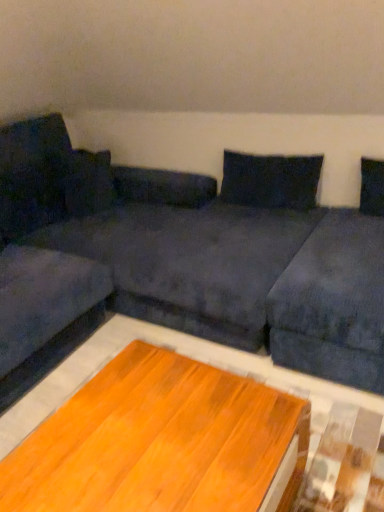
Question: Is velvet dark blue couch at left to the right of dark blue fabric pillow at upper center from the viewer's perspective?

Choices:
 (A) no
 (B) yes

Answer: (A)

Question: Are velvet dark blue couch at left and dark blue fabric pillow at upper center making contact?

Choices:
 (A) no
 (B) yes

Answer: (A)

Question: From a real-world perspective, is velvet dark blue couch at left on dark blue fabric pillow at upper center?

Choices:
 (A) yes
 (B) no

Answer: (B)

Question: Does velvet dark blue couch at left have a greater height compared to dark blue fabric pillow at upper center?

Choices:
 (A) no
 (B) yes

Answer: (B)

Question: Can you confirm if velvet dark blue couch at left is wider than dark blue fabric pillow at upper center?

Choices:
 (A) no
 (B) yes

Answer: (B)

Question: Considering the positions of point (178, 280) and point (172, 382), is point (178, 280) closer or farther from the camera than point (172, 382)?

Choices:
 (A) closer
 (B) farther

Answer: (B)

Question: Is dark blue fabric couch at center in front of or behind wooden table at center in the image?

Choices:
 (A) front
 (B) behind

Answer: (A)

Question: Is dark blue fabric couch at center spatially inside wooden table at center, or outside of it?

Choices:
 (A) inside
 (B) outside

Answer: (B)

Question: Is dark blue fabric couch at center wider or thinner than wooden table at center?

Choices:
 (A) thin
 (B) wide

Answer: (B)

Question: Considering their positions, is dark blue fabric couch at center located in front of or behind dark blue fabric pillow at upper center?

Choices:
 (A) behind
 (B) front

Answer: (B)

Question: Is point (226, 338) closer or farther from the camera than point (296, 170)?

Choices:
 (A) closer
 (B) farther

Answer: (A)

Question: Considering the positions of dark blue fabric couch at center and dark blue fabric pillow at upper center in the image, is dark blue fabric couch at center taller or shorter than dark blue fabric pillow at upper center?

Choices:
 (A) short
 (B) tall

Answer: (B)

Question: From a real-world perspective, is dark blue fabric couch at center above or below dark blue fabric pillow at upper center?

Choices:
 (A) below
 (B) above

Answer: (A)

Question: From a real-world perspective, is dark blue fabric pillow at upper center above or below dark blue fabric couch at center?

Choices:
 (A) above
 (B) below

Answer: (A)

Question: Is point (271, 159) positioned closer to the camera than point (354, 364)?

Choices:
 (A) closer
 (B) farther

Answer: (B)